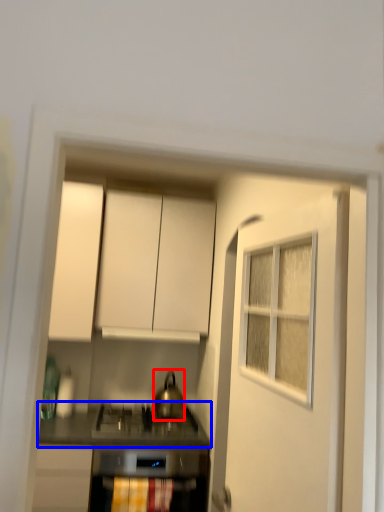
Question: Which object is further to the camera taking this photo, kitchen appliance (highlighted by a red box) or countertop (highlighted by a blue box)?

Choices:
 (A) kitchen appliance
 (B) countertop

Answer: (A)